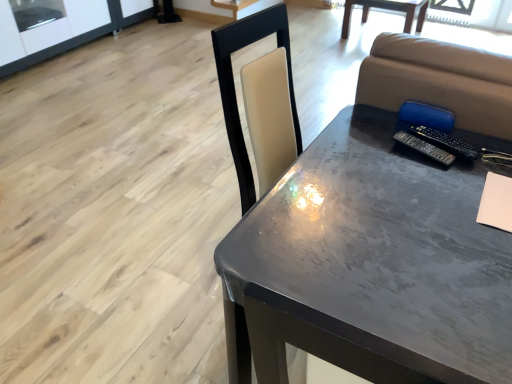
Locate an element on the screen. Image resolution: width=512 pixels, height=384 pixels. vacant area that lies to the right of black plastic remote at right, which appears as the first remote when viewed from the left is located at coordinates (481, 151).